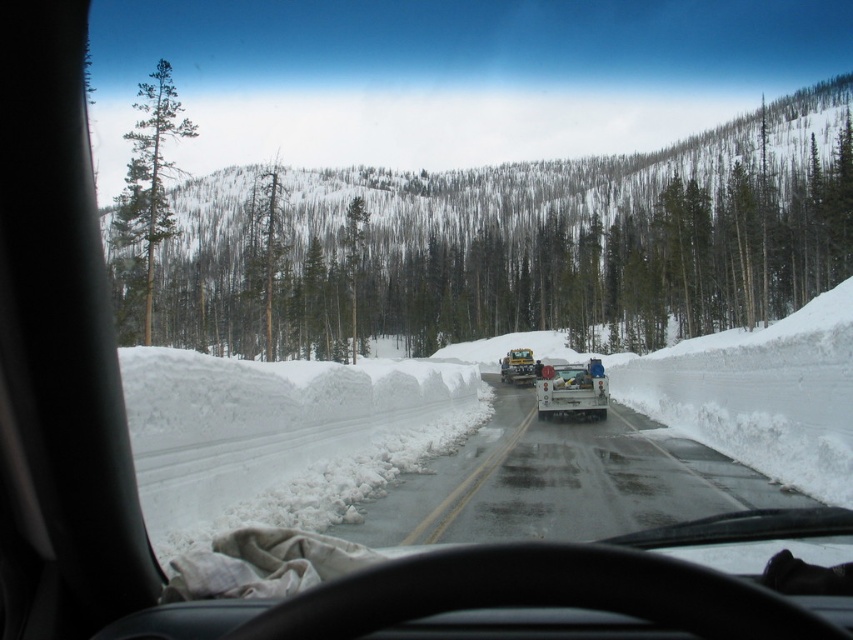
You are driving a delivery van that is 2 meters tall. You see the white glossy truck at center and the white matte trailer truck at center ahead on the road. Can your van pass under them without hitting the trucks?

The white glossy truck at center has a lesser height compared to the white matte trailer truck at center. Since your van is 2 meters tall, you need to check the minimum height clearance. If the white glossy truck at center is shorter than 2 meters, you might hit it, but the taller white matte trailer truck at center could have a higher clearance. Without exact measurements, it is uncertain. However, since the glossy truck is shorter, prioritize checking its height first.

You are driving a car and see the white glossy truck at center and the white matte trailer truck at center ahead on the road. Which one is closer to the left side of the road?

The white glossy truck at center is closer to the left side of the road because it is positioned to the left of the white matte trailer truck at center.

You are driving a car and see the white matte trailer truck at center and the white glossy trailer truck at center ahead on the road. Which one is shorter in height?

The white matte trailer truck at center is not as tall as the white glossy trailer truck at center, so the white matte trailer truck at center is shorter.